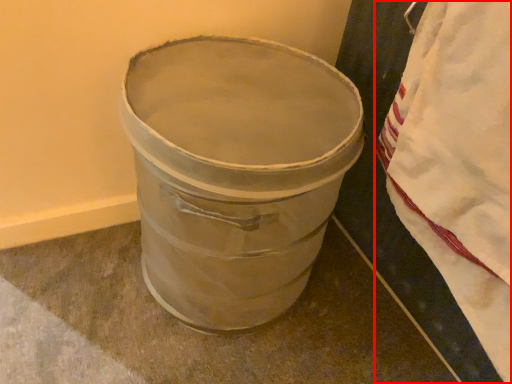
Question: From the image's perspective, what is the correct spatial positioning of blanket (annotated by the red box) in reference to waste container?

Choices:
 (A) below
 (B) above

Answer: (B)